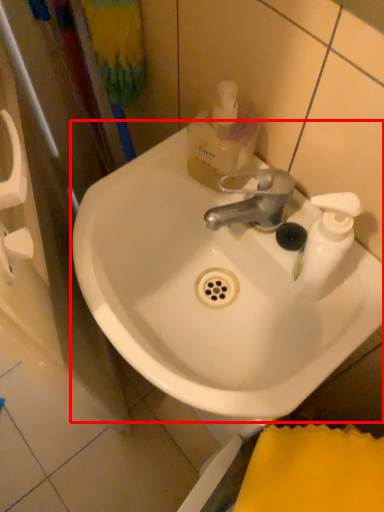
Question: From the image's perspective, where is sink (annotated by the red box) located in relation to mouthwash in the image?

Choices:
 (A) below
 (B) above

Answer: (A)